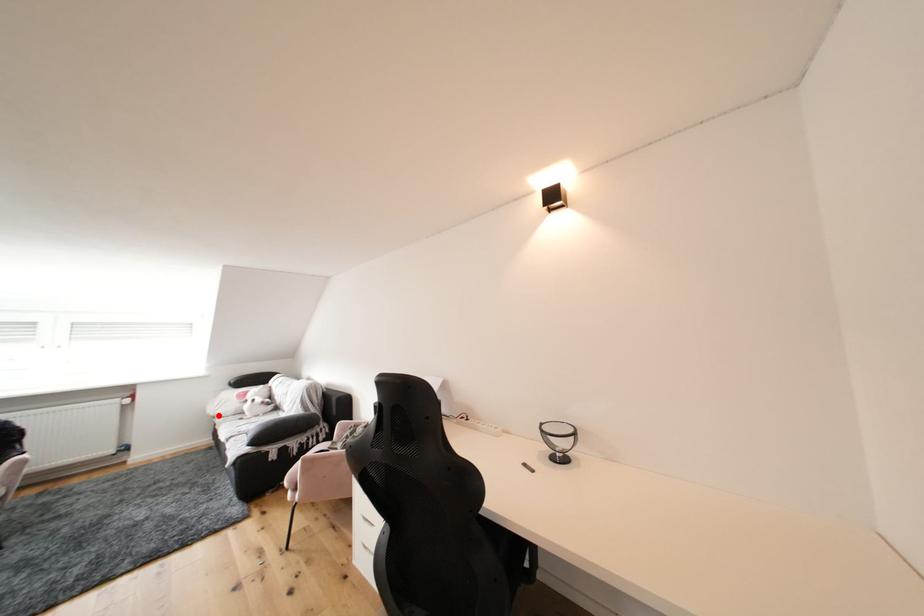
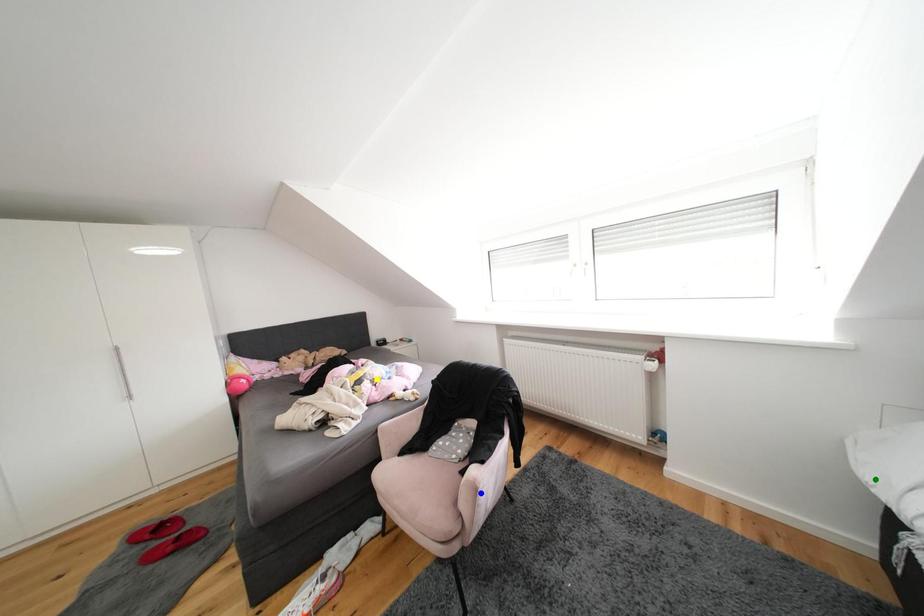
Question: I am providing you with two images of the same scene from different viewpoints. A red point is marked on the first image. You are given multiple points on the second image. Which mark in image 2 goes with the point in image 1?

Choices:
 (A) green point
 (B) blue point
 (C) yellow point

Answer: (A)